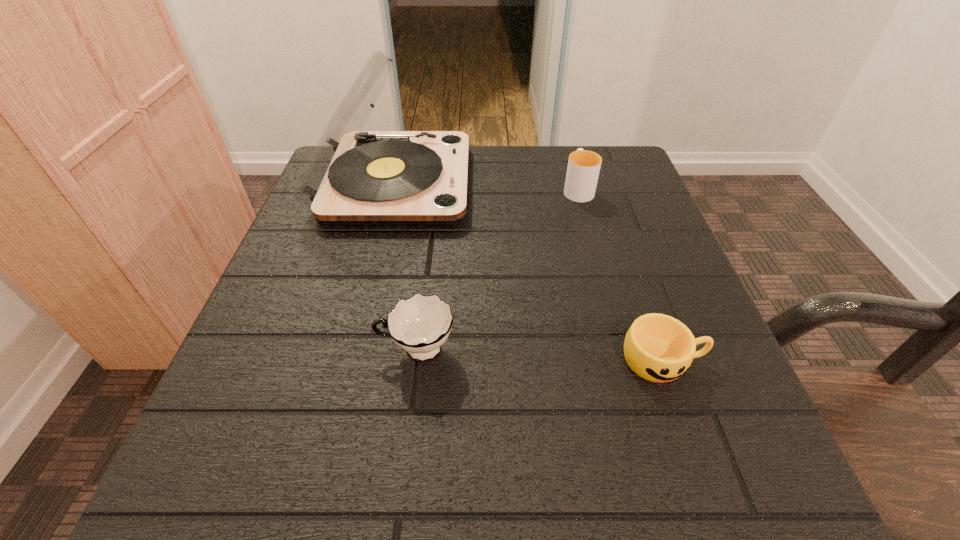
What are the coordinates of `record player located at the far edge` in the screenshot? It's located at (353, 177).

Locate an element on the screen. The height and width of the screenshot is (540, 960). cup present at the far edge is located at coordinates (583, 169).

Find the location of a particular element. The image size is (960, 540). object at the left edge is located at coordinates (353, 177).

The image size is (960, 540). Find the location of `object that is at the far left corner`. object that is at the far left corner is located at coordinates (353, 177).

Find the location of `object that is at the far right corner`. object that is at the far right corner is located at coordinates (583, 169).

Identify the location of vacant space at the far edge of the desktop. The height and width of the screenshot is (540, 960). (543, 198).

In the image, there is a desktop. What are the coordinates of `vacant space at the left edge` in the screenshot? It's located at pyautogui.click(x=297, y=323).

The width and height of the screenshot is (960, 540). I want to click on blank space at the right edge, so click(596, 214).

Find the location of a particular element. This screenshot has height=540, width=960. free space at the far right corner is located at coordinates (599, 185).

Locate an element on the screen. This screenshot has height=540, width=960. vacant point located between the shortest object and the leftmost cup is located at coordinates (540, 355).